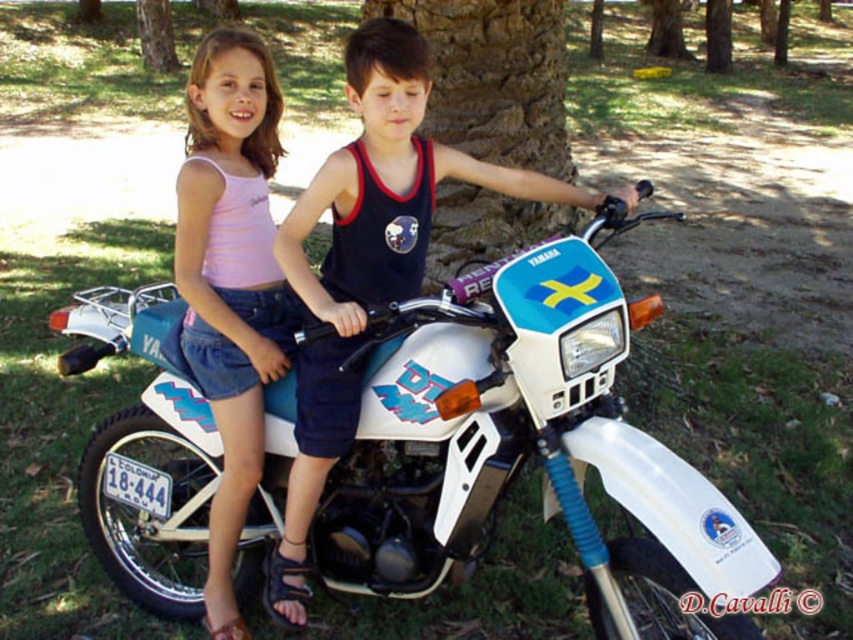
You are a photographer trying to capture the boy in the dark blue tank top with Snoopy graphic. The camera you are using has a limited focus range. The focus point is set at the coordinates point (366,262). Will the focus point be on the boy?

The point (366,262) corresponds to the matte white tank top at center, which is not the boy in the dark blue tank top with Snoopy graphic. Therefore, the focus point will not be on the boy.

You are a photographer trying to capture a clear shot of the matte white tank top at center and the brown textured tree trunk at upper center. Which object should you focus on first if you want to ensure both are in focus without adjusting the camera settings?

You should focus on the matte white tank top at center first since it is closer to the viewer than the brown textured tree trunk at upper center. By focusing on the closer object, the tree trunk will fall into the depth of field range, ensuring both are in focus.